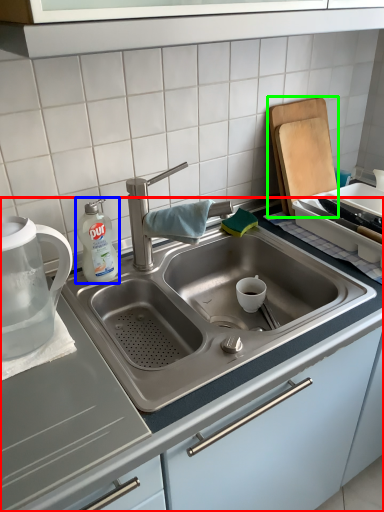
Question: Which object is the closest to the countertop (highlighted by a red box)? Choose among these: cleaning product (highlighted by a blue box) or cutting board (highlighted by a green box).

Choices:
 (A) cleaning product
 (B) cutting board

Answer: (A)